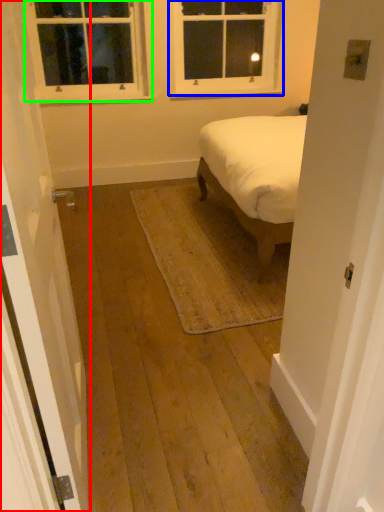
Question: Which is farther away from door (highlighted by a red box)? window (highlighted by a blue box) or window (highlighted by a green box)?

Choices:
 (A) window
 (B) window

Answer: (A)